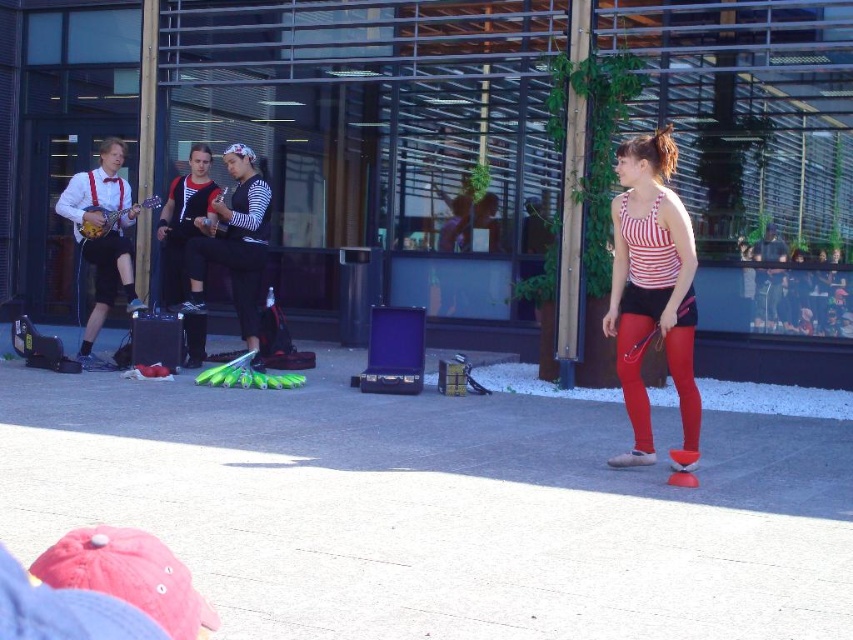
Does striped fabric tank top at center have a greater height compared to matte red suspenders at left?

No.

Who is positioned more to the right, striped fabric tank top at center or matte red suspenders at left?

striped fabric tank top at center is more to the right.

Locate an element on the screen. striped fabric tank top at center is located at coordinates (651, 288).

From the picture: Who is more forward, [682,250] or [254,164]?

Positioned in front is point [682,250].

Which is more to the left, striped fabric tank top at center or striped fabric top at center?

From the viewer's perspective, striped fabric top at center appears more on the left side.

This screenshot has height=640, width=853. Describe the element at coordinates (651, 288) in the screenshot. I see `striped fabric tank top at center` at that location.

You are a GUI agent. You are given a task and a screenshot of the screen. Output one action in this format:
    pyautogui.click(x=<x>, y=<y>)
    Task: Click on the striped fabric tank top at center
    The image size is (853, 640).
    Given the screenshot: What is the action you would take?
    pyautogui.click(x=651, y=288)

This screenshot has height=640, width=853. I want to click on smooth concrete pavement at center, so click(437, 508).

Who is more distant from viewer, (251, 472) or (686, 378)?

The point (686, 378) is more distant.

Find the location of a particular element. The height and width of the screenshot is (640, 853). smooth concrete pavement at center is located at coordinates [x=437, y=508].